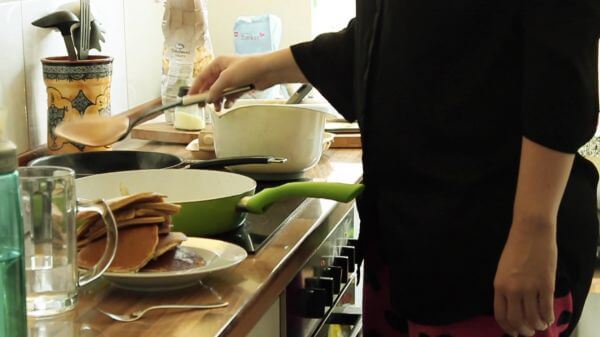
The height and width of the screenshot is (337, 600). What are the coordinates of `fork` in the screenshot? It's located at (150, 307).